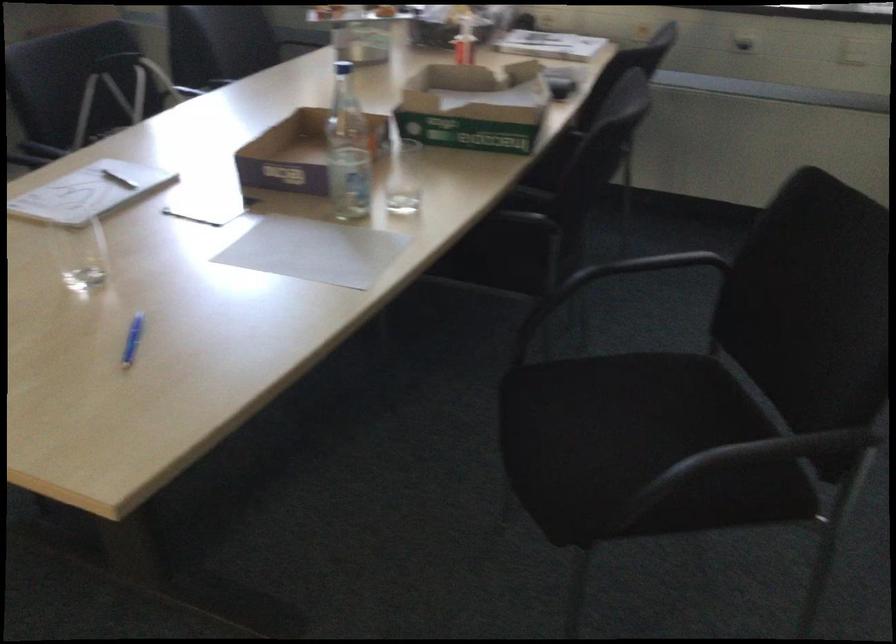
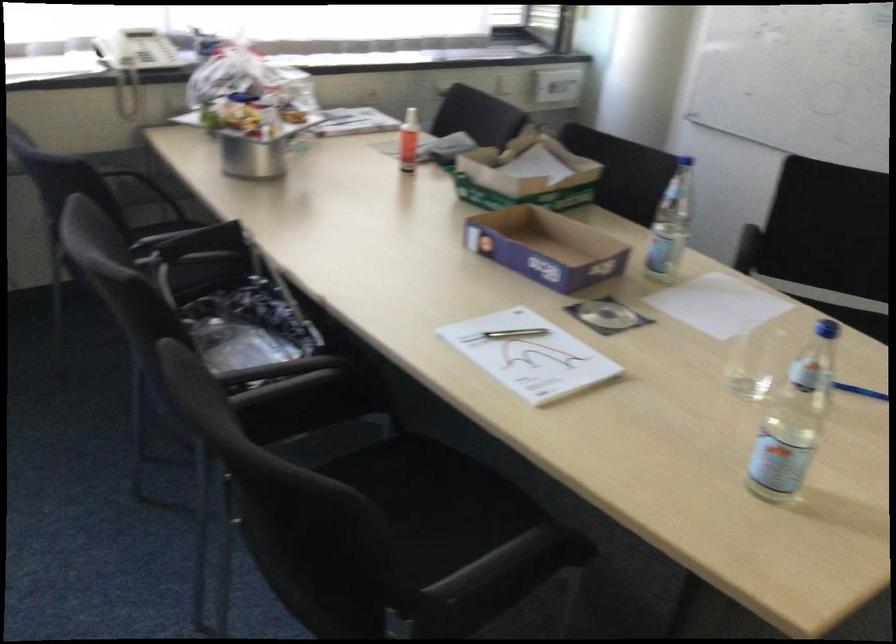
In the second image, find the point that corresponds to point 125,192 in the first image.

(514, 333)